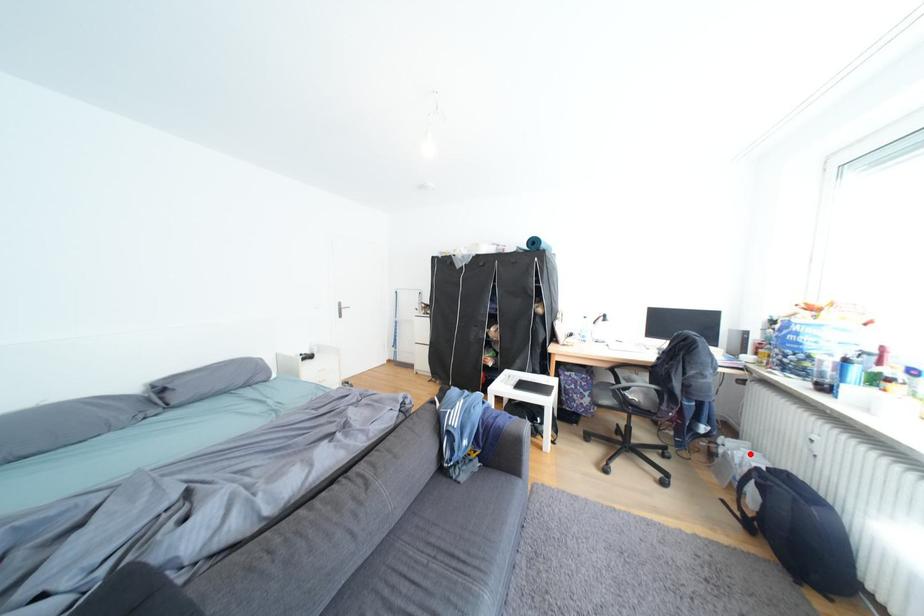
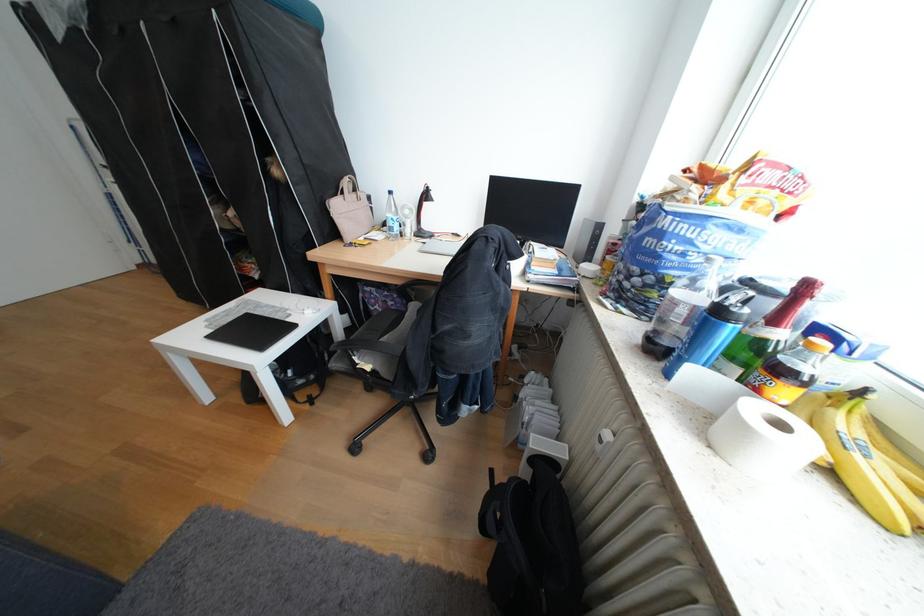
Question: I am providing you with two images of the same scene from different viewpoints. Given a red point in image1, look at the same physical point in image2. Is it:

Choices:
 (A) Closer to the viewpoint
 (B) Farther from the viewpoint

Answer: (A)